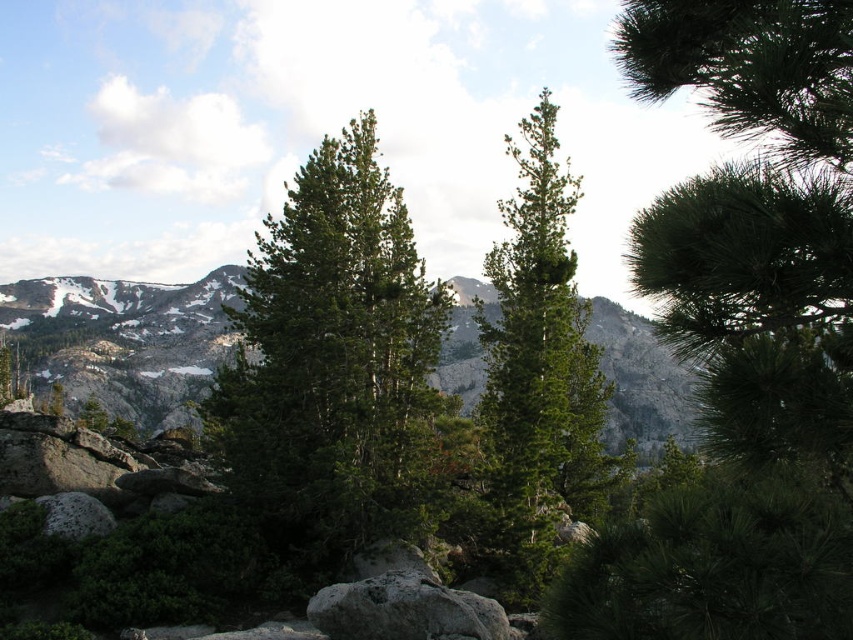
Can you confirm if green needle-like at center is positioned to the left of green needle-like tree at center?

No, green needle-like at center is not to the left of green needle-like tree at center.

Is point (724, 467) more distant than point (415, 426)?

No.

I want to click on green needle-like at center, so click(x=743, y=337).

Looking at this image, is green needle-like at center positioned behind green matte tree at center?

That is False.

The image size is (853, 640). What do you see at coordinates (743, 337) in the screenshot? I see `green needle-like at center` at bounding box center [743, 337].

Which is behind, point (811, 465) or point (548, 339)?

The point (548, 339) is more distant.

Identify the location of green needle-like at center. (743, 337).

Who is shorter, rocky gray mountain at center or green matte tree at center?

green matte tree at center is shorter.

In the scene shown: Does rocky gray mountain at center have a greater height compared to green matte tree at center?

Correct, rocky gray mountain at center is much taller as green matte tree at center.

Image resolution: width=853 pixels, height=640 pixels. I want to click on rocky gray mountain at center, so click(125, 340).